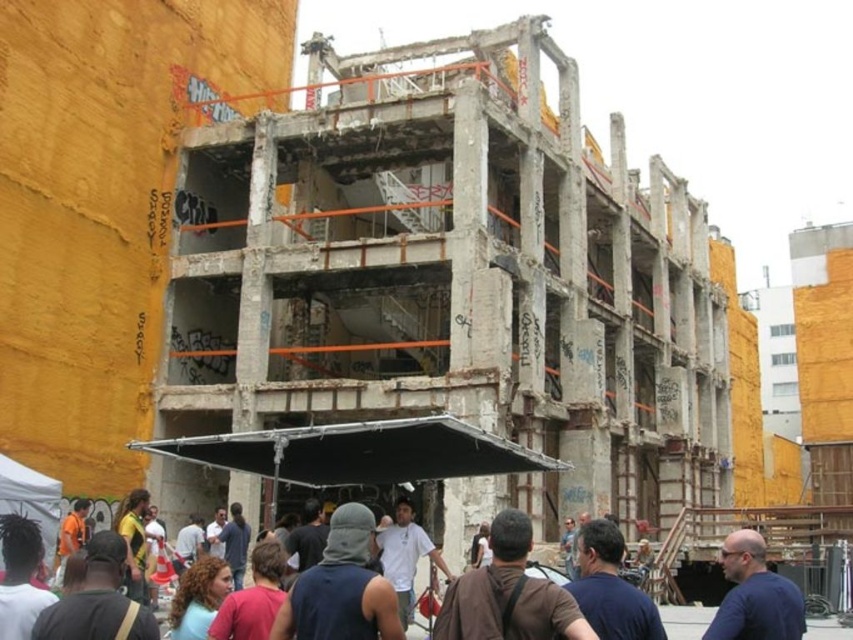
Is point (651, 604) farther from viewer compared to point (767, 627)?

No, it is in front of (767, 627).

Does dark brown leather jacket at lower center have a larger size compared to blue shirt at center?

Indeed, dark brown leather jacket at lower center has a larger size compared to blue shirt at center.

This screenshot has width=853, height=640. What do you see at coordinates (753, 595) in the screenshot?
I see `dark brown leather jacket at lower center` at bounding box center [753, 595].

Locate an element on the screen. This screenshot has width=853, height=640. dark brown leather jacket at lower center is located at coordinates (753, 595).